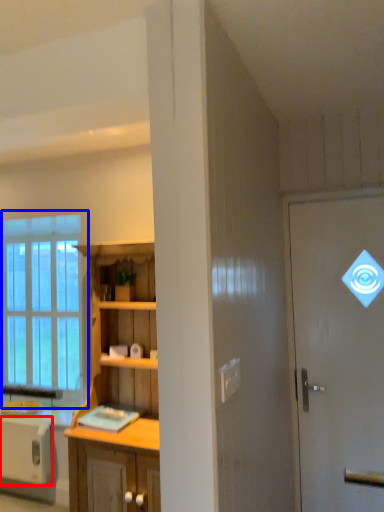
Question: Among these objects, which one is nearest to the camera, appliance (highlighted by a red box) or window (highlighted by a blue box)?

Choices:
 (A) appliance
 (B) window

Answer: (A)